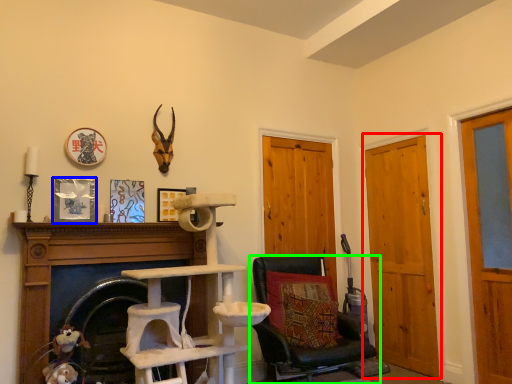
Question: Estimate the real-world distances between objects in this image. Which object is closer to door (highlighted by a red box), picture frame (highlighted by a blue box) or chair (highlighted by a green box)?

Choices:
 (A) picture frame
 (B) chair

Answer: (B)